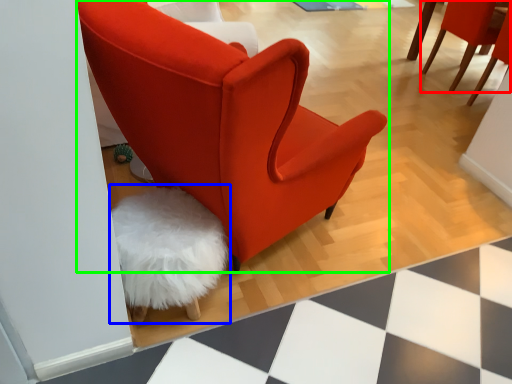
Question: Estimate the real-world distances between objects in this image. Which object is closer to chair (highlighted by a red box), swivel chair (highlighted by a blue box) or chair (highlighted by a green box)?

Choices:
 (A) swivel chair
 (B) chair

Answer: (B)